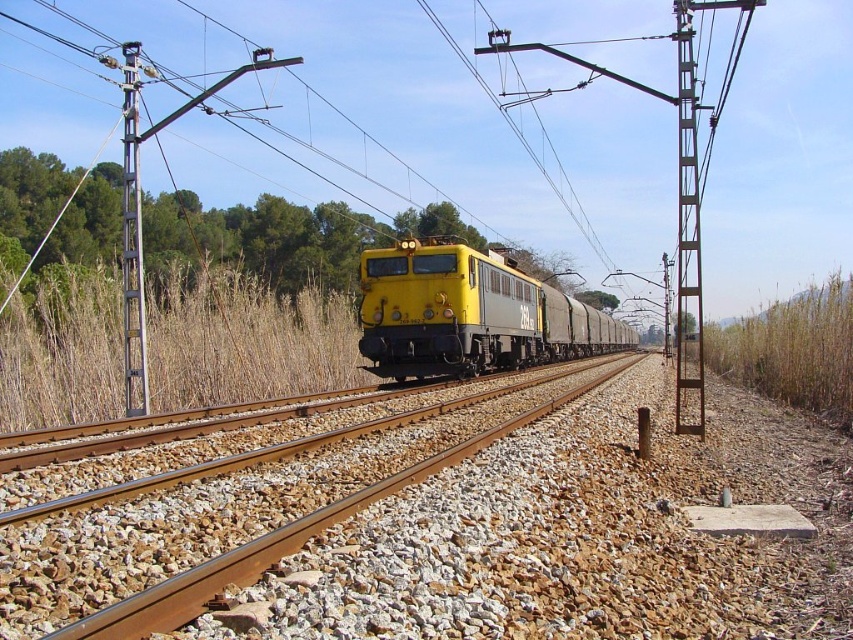
You are a railway inspector checking the track conditions. You notice the brown gravel track at center and the yellow matte train at center. Which object is longer?

The yellow matte train at center is longer than the brown gravel track at center.

You are a train engineer who needs to ensure the brown gravel track at center is correctly positioned for the locomotive. Based on the coordinates provided, is the track positioned centrally in the frame?

The brown gravel track at center is located at point (271, 524), which means it is positioned centrally in the frame as described.